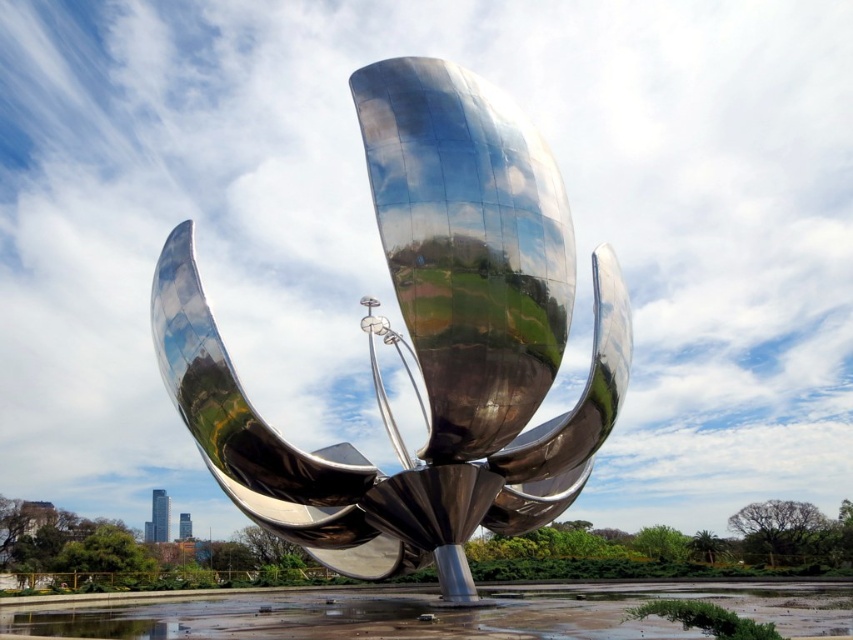
Can you confirm if polished metallic flower at center is positioned below shiny metallic sculpture at center?

No, polished metallic flower at center is not below shiny metallic sculpture at center.

Who is shorter, polished metallic flower at center or shiny metallic sculpture at center?

polished metallic flower at center

Is point (593, 362) positioned before point (120, 620)?

Yes, it is in front of point (120, 620).

The height and width of the screenshot is (640, 853). In order to click on polished metallic flower at center in this screenshot , I will do `click(426, 340)`.